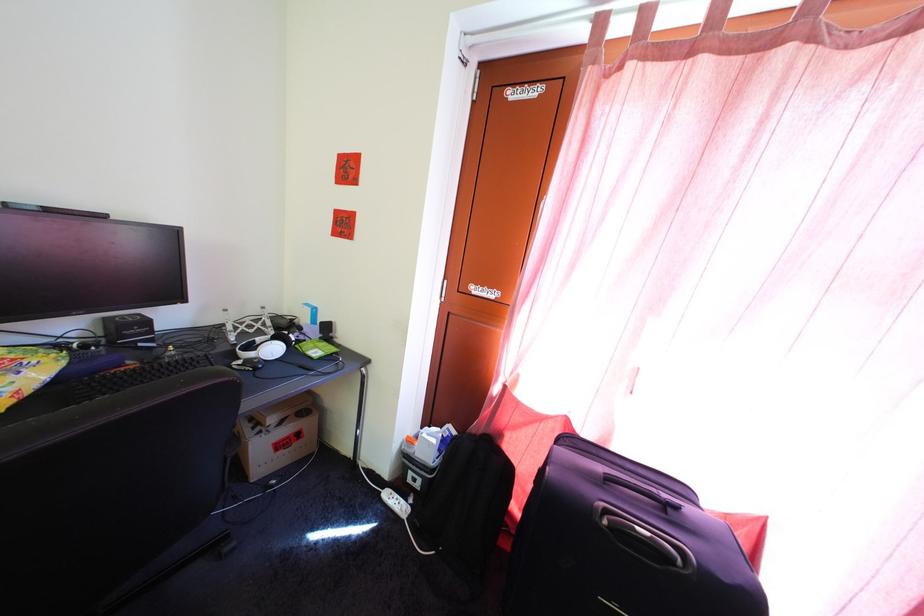
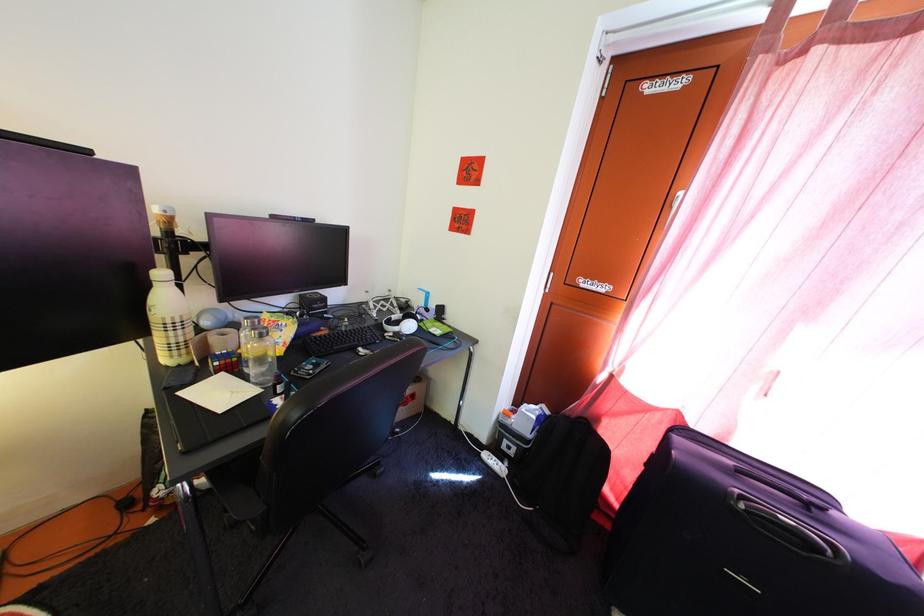
The point at (252, 341) is marked in the first image. Where is the corresponding point in the second image?

(388, 318)